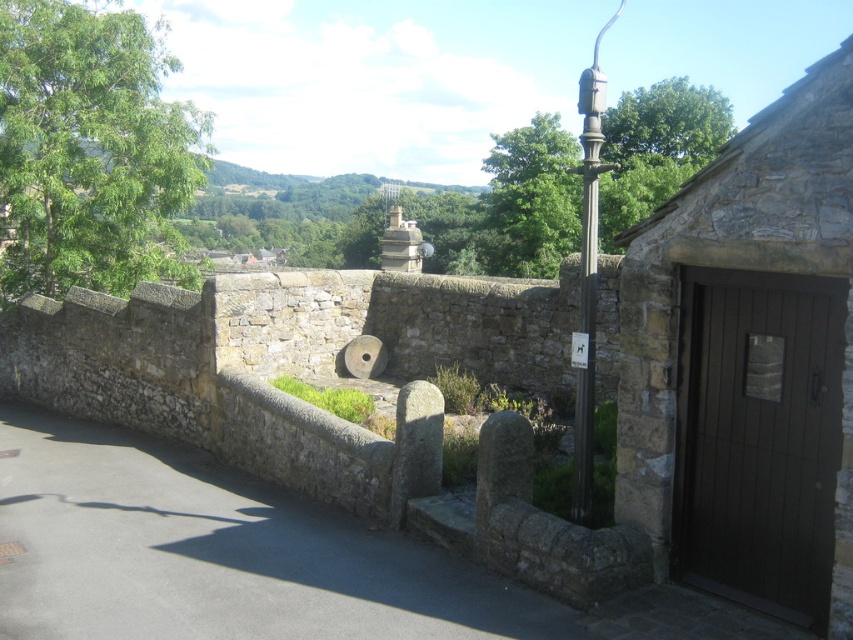
Is point (596, 228) more distant than point (584, 392)?

That is False.

Who is positioned more to the left, polished metal lamp post at center-right or polished stone post at center?

Positioned to the left is polished stone post at center.

Which is behind, point (592, 60) or point (582, 257)?

The point (592, 60) is behind.

Where is `polished metal lamp post at center-right`? polished metal lamp post at center-right is located at coordinates (589, 275).